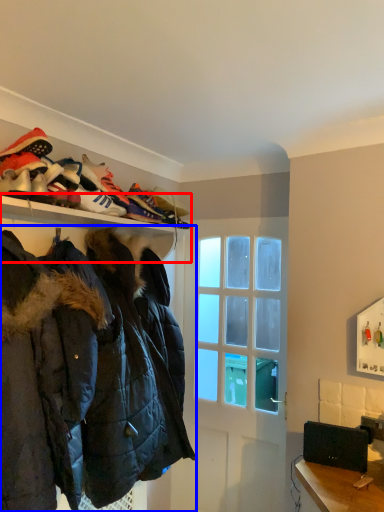
Question: Which of the following is the closest to the observer, shelf (highlighted by a red box) or jacket (highlighted by a blue box)?

Choices:
 (A) shelf
 (B) jacket

Answer: (B)